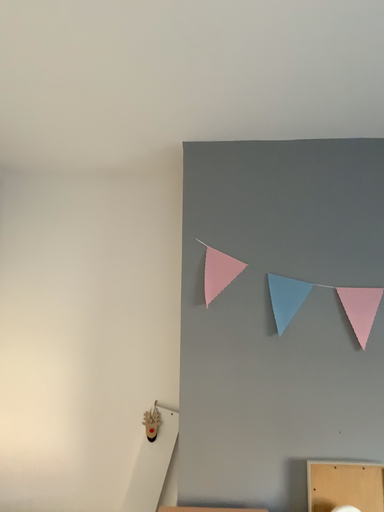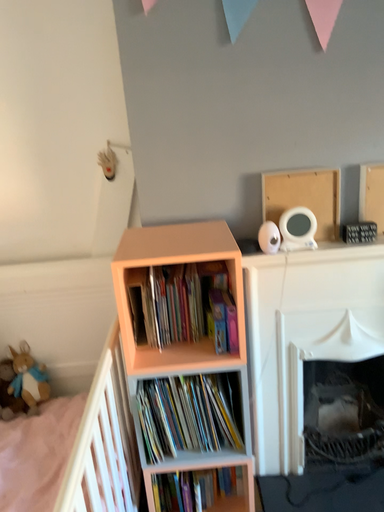
Question: How did the camera likely rotate when shooting the video?

Choices:
 (A) rotated downward
 (B) rotated upward

Answer: (A)